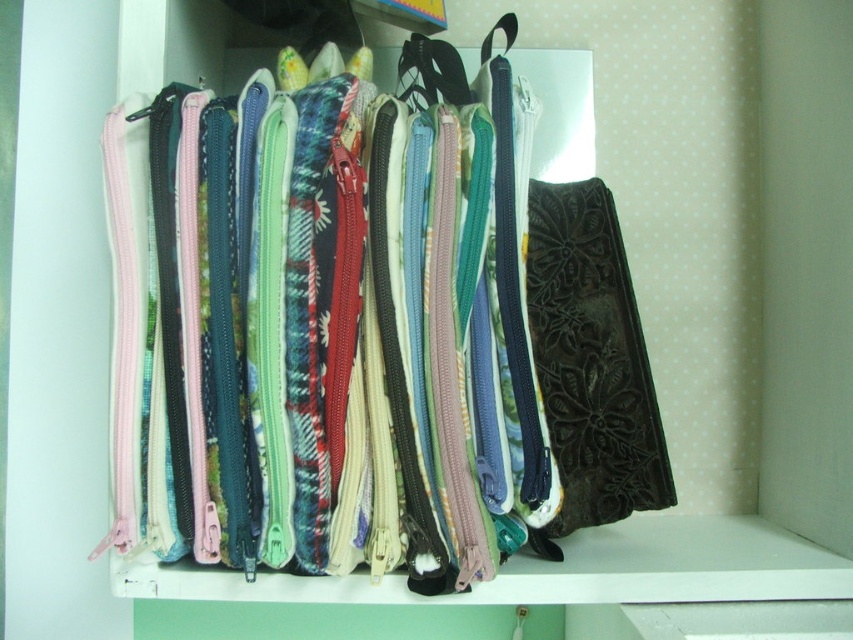
You are organizing a small storage shelf and have both the textured fabric zipper pouches at center and the matte black strap at center. If you want to place the smaller item in a narrow drawer, which one should you choose?

The matte black strap at center is smaller than the textured fabric zipper pouches at center, so you should choose the matte black strap at center for the narrow drawer.

You are organizing a small gift basket and need to choose between the velvet floral pouch at center and the matte black strap at center. Based on their sizes, which one would you pick to ensure it can hold more items?

The velvet floral pouch at center is larger in size than the matte black strap at center, so it can hold more items.

You are a customer trying to reach for the matte black strap at center while holding the velvet floral pouch at center. Can you comfortably hold both items at the same time without dropping either?

The velvet floral pouch at center and matte black strap at center are 8.26 inches apart. Since the distance between them is more than the typical hand span, you may struggle to hold both comfortably without dropping one.